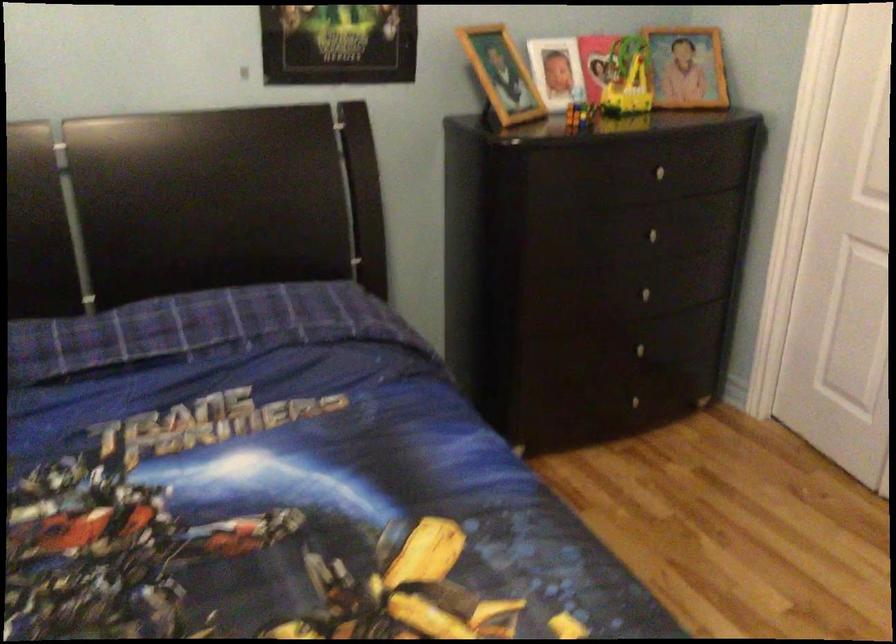
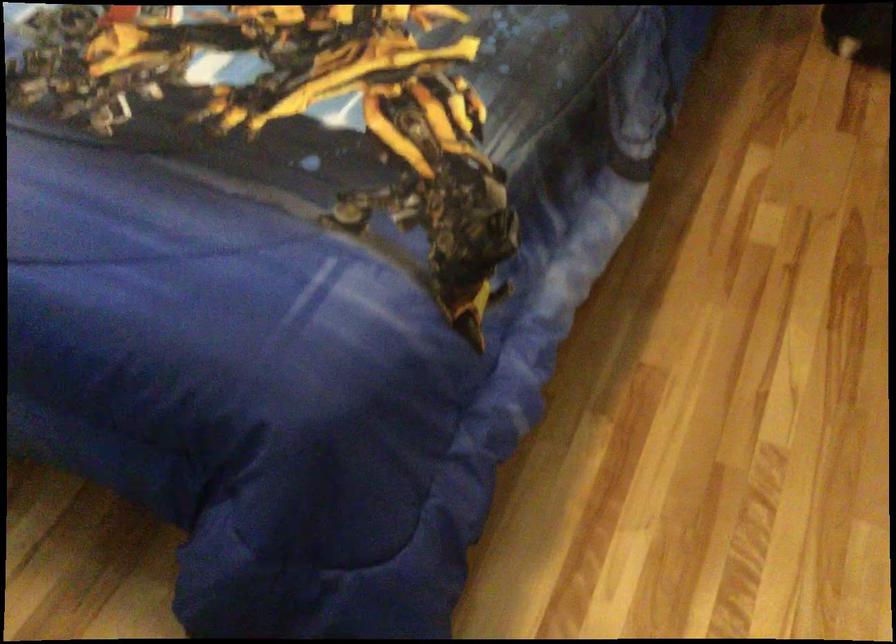
First-person continuous shooting, in which direction is the camera rotating?

The camera rotated toward left-down.